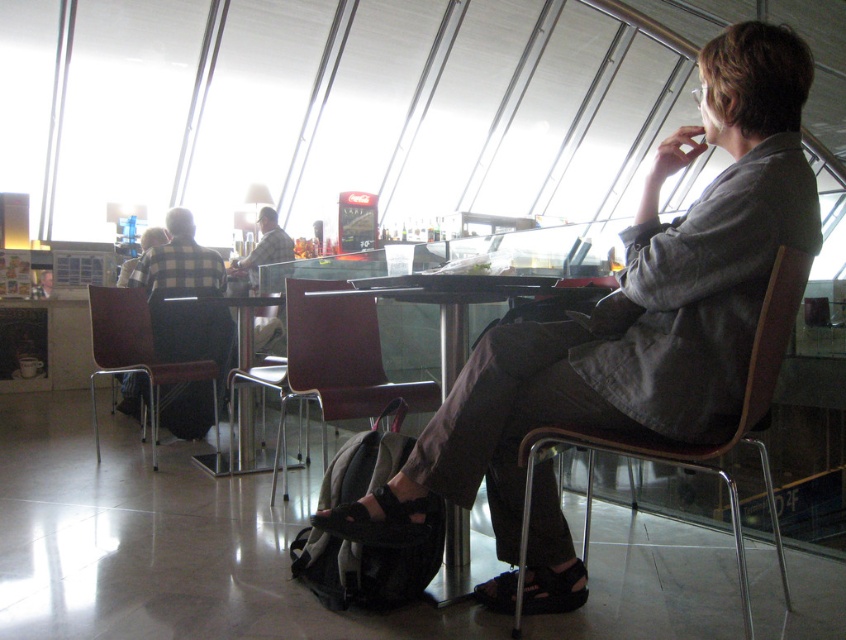
Is brown leather chair at right bigger than checkered fabric shirt at left?

Actually, brown leather chair at right might be smaller than checkered fabric shirt at left.

How much distance is there between brown leather chair at right and checkered fabric shirt at left?

They are 2.54 meters apart.

Is point (764, 483) positioned before point (191, 346)?

Yes, point (764, 483) is in front of point (191, 346).

I want to click on brown leather chair at right, so click(x=685, y=444).

Measure the distance between matte gray shirt at center and brown leather chair at right.

The distance of matte gray shirt at center from brown leather chair at right is 8.92 inches.

Describe the element at coordinates (633, 310) in the screenshot. The width and height of the screenshot is (846, 640). I see `matte gray shirt at center` at that location.

Who is more forward, (x=810, y=186) or (x=519, y=444)?

Point (x=810, y=186) is in front.

Locate an element on the screen. Image resolution: width=846 pixels, height=640 pixels. matte gray shirt at center is located at coordinates (633, 310).

Is point (755, 218) behind point (232, 369)?

No, (755, 218) is in front of (232, 369).

Which is behind, point (699, 365) or point (320, 348)?

Point (320, 348)

Find the location of a particular element. The height and width of the screenshot is (640, 846). matte gray shirt at center is located at coordinates (633, 310).